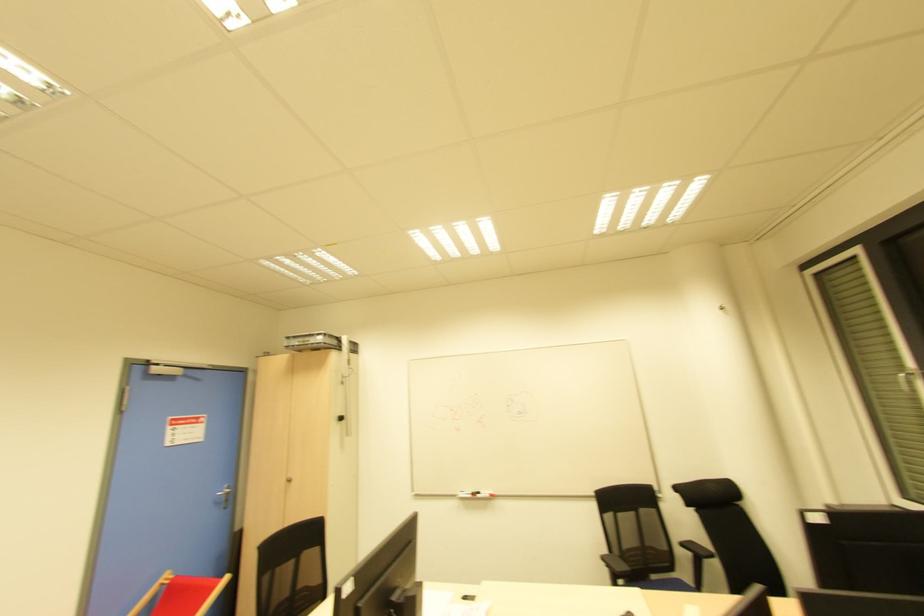
What do you see at coordinates (904, 379) in the screenshot?
I see `the window handle` at bounding box center [904, 379].